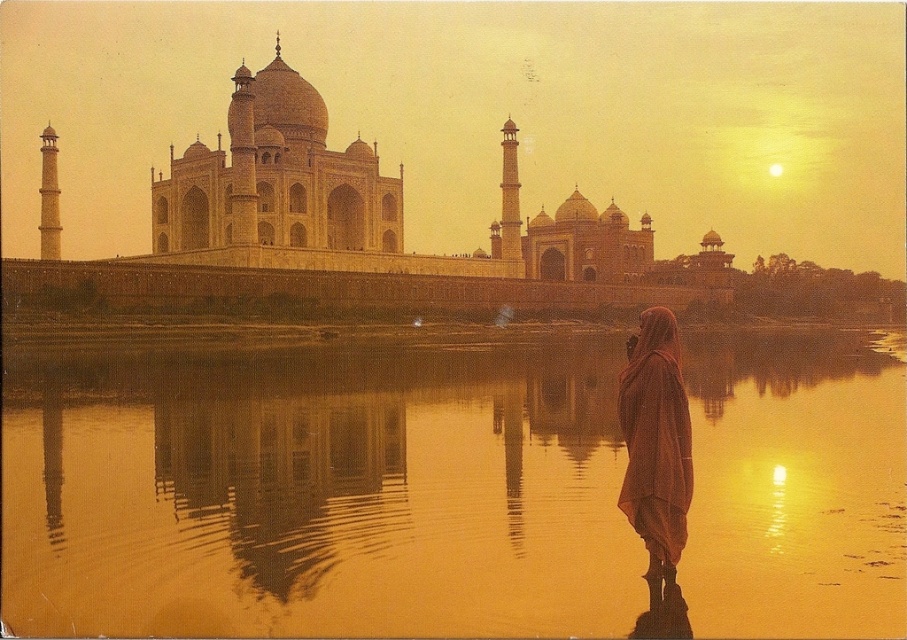
You are a tourist visiting the Taj Mahal and want to take a photo of the smooth golden water at center and the silky brown scarf at lower right. Based on their positions, which object should you place on the left side of your photo to capture both in the frame?

You should place the smooth golden water at center on the left side of your photo since it is already positioned to the left of the silky brown scarf at lower right.

You are a tourist standing at the edge of the Yamuna River, near the smooth golden water at center. You want to reach the silky brown scarf at lower right without getting your shoes wet. The scarf is 16.64 meters away from the water. Can you walk directly to the scarf along the path between them?

The distance between the smooth golden water at center and the silky brown scarf at lower right is 16.64 meters. Since the scarf is 16.64 meters away from the water, you can walk directly to the scarf along the path between them as the distance is sufficient to avoid getting your shoes wet.

You are a tourist visiting the Taj Mahal and want to take a photo of the smooth golden water at center and the silky brown scarf at lower right. Which object should you focus on first if you want both to be in sharp focus?

The smooth golden water at center is closer to the viewer than the silky brown scarf at lower right. To have both objects in sharp focus, you should focus on the silky brown scarf at lower right because it is farther away, ensuring the depth of field includes both.